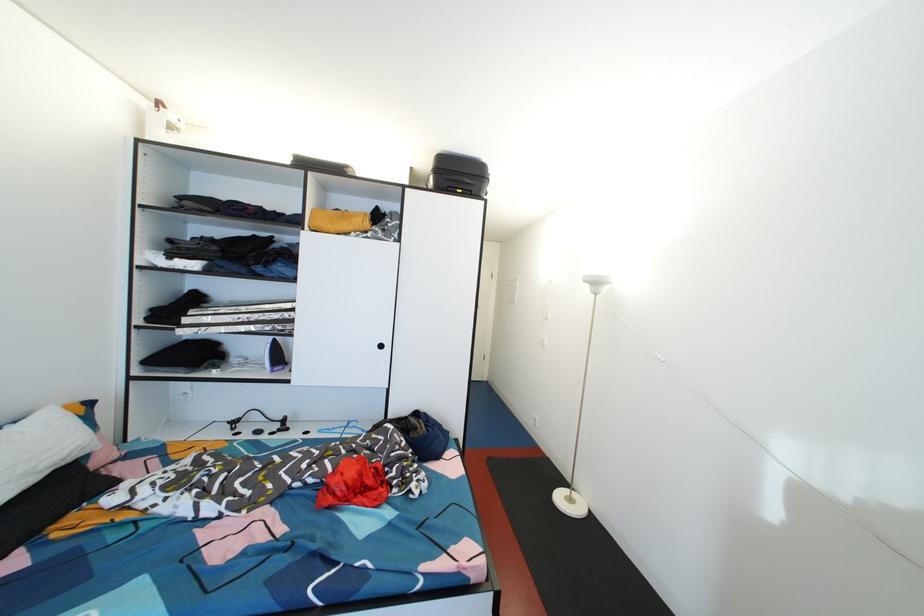
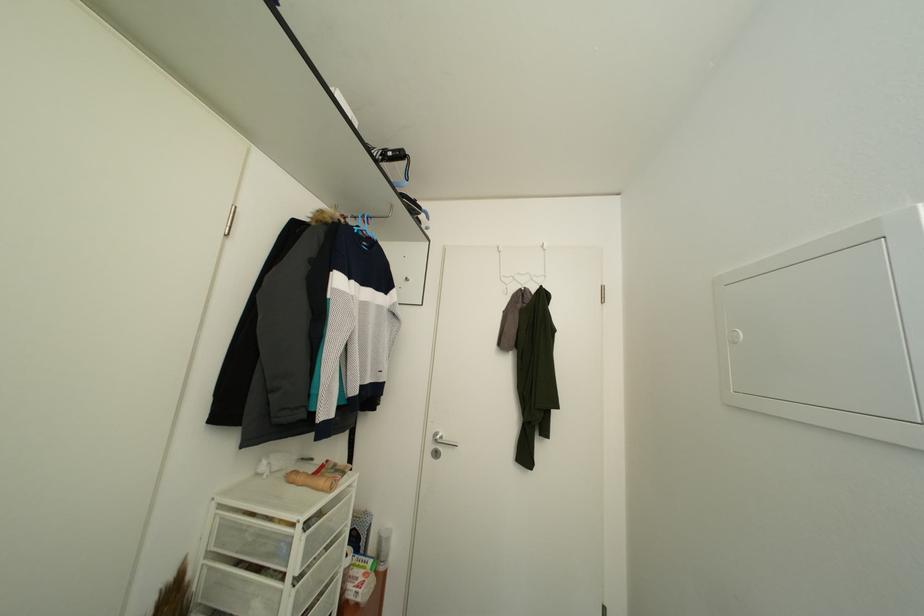
Question: In a continuous first-person perspective shot, in which direction is the camera moving?

Choices:
 (A) Left
 (B) Right
 (C) Forward
 (D) Backward

Answer: (C)